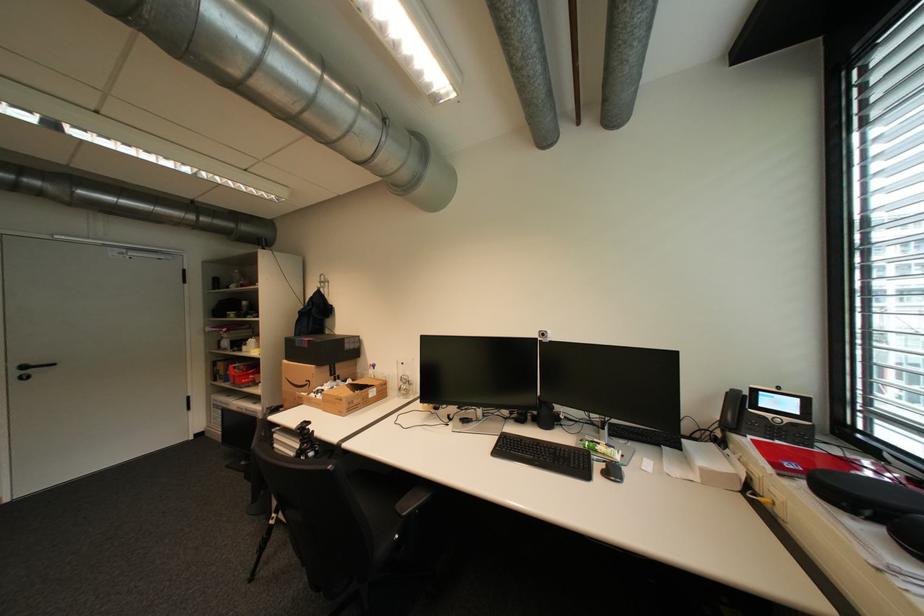
Where would you lift the open cardboard box? Please return your answer as a coordinate pair (x, y).

(321, 369)